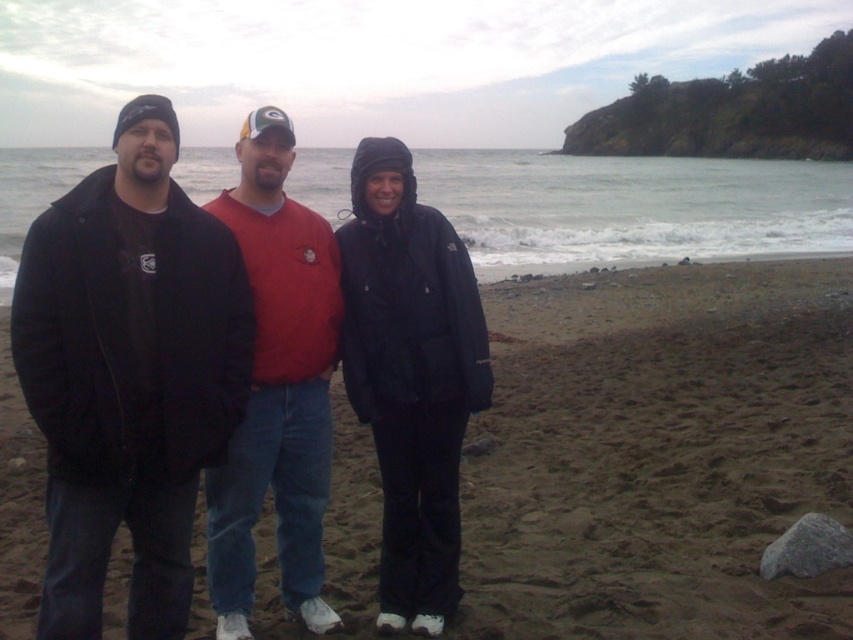
Which is more to the right, matte black jacket at left or matte black jacket at center?

matte black jacket at center

Does matte black jacket at left have a lesser width compared to matte black jacket at center?

Yes, matte black jacket at left is thinner than matte black jacket at center.

Does point (22, 346) lie in front of point (416, 308)?

Yes, it is in front of point (416, 308).

Identify the location of matte black jacket at left. (128, 372).

At what (x,y) coordinates should I click in order to perform the action: click on matte black jacket at center. Please return your answer as a coordinate pair (x, y). Looking at the image, I should click on (410, 376).

Is point (370, 340) positioned in front of point (254, 454)?

That is False.

What do you see at coordinates (410, 376) in the screenshot? Image resolution: width=853 pixels, height=640 pixels. I see `matte black jacket at center` at bounding box center [410, 376].

You are a GUI agent. You are given a task and a screenshot of the screen. Output one action in this format:
    pyautogui.click(x=<x>, y=<y>)
    Task: Click on the matte black jacket at center
    
    Given the screenshot: What is the action you would take?
    pyautogui.click(x=410, y=376)

Does brown sandy beach at center come behind matte red sweater at center?

Yes.

The width and height of the screenshot is (853, 640). I want to click on brown sandy beach at center, so 659,452.

In order to click on brown sandy beach at center in this screenshot , I will do `click(659, 452)`.